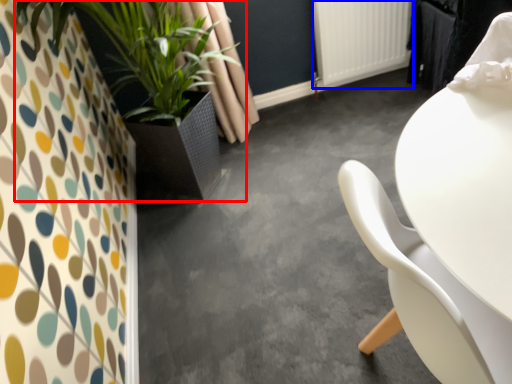
Question: Which object is further to the camera taking this photo, houseplant (highlighted by a red box) or radiator (highlighted by a blue box)?

Choices:
 (A) houseplant
 (B) radiator

Answer: (B)